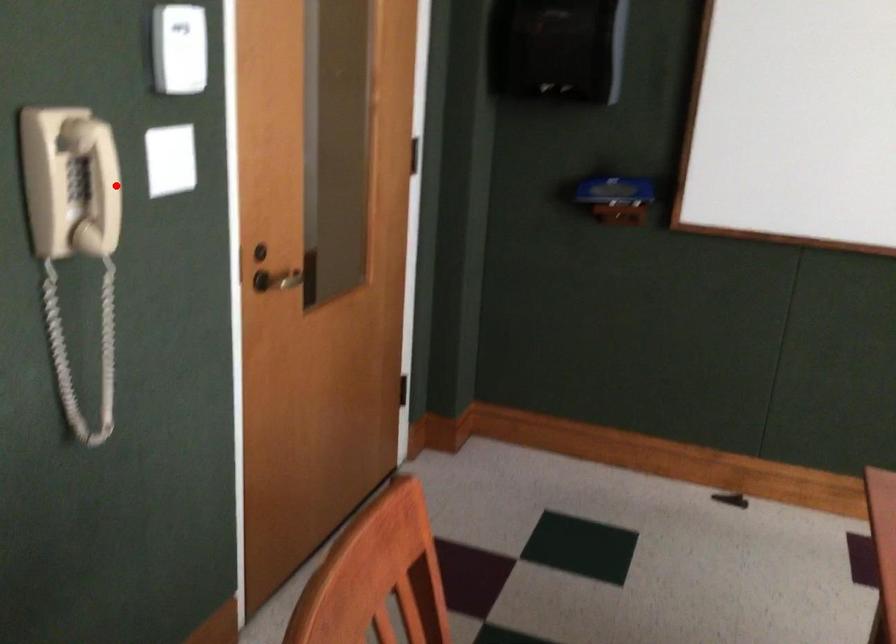
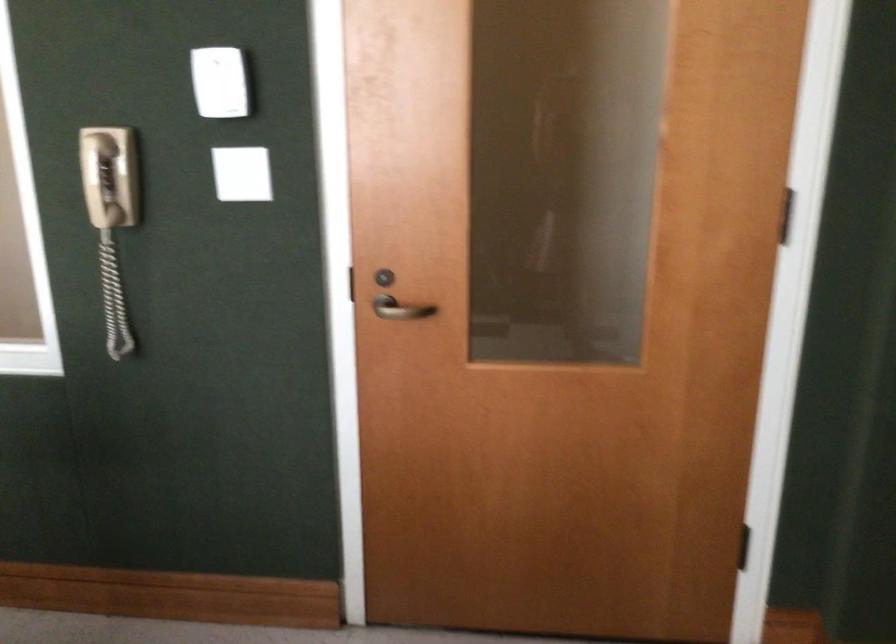
Question: I am providing you with two images of the same scene from different viewpoints. Image1 has a red point marked. In image2, the corresponding 3D location appears at what relative position? Reply with the corresponding letter.

Choices:
 (A) Closer
 (B) Farther

Answer: (B)